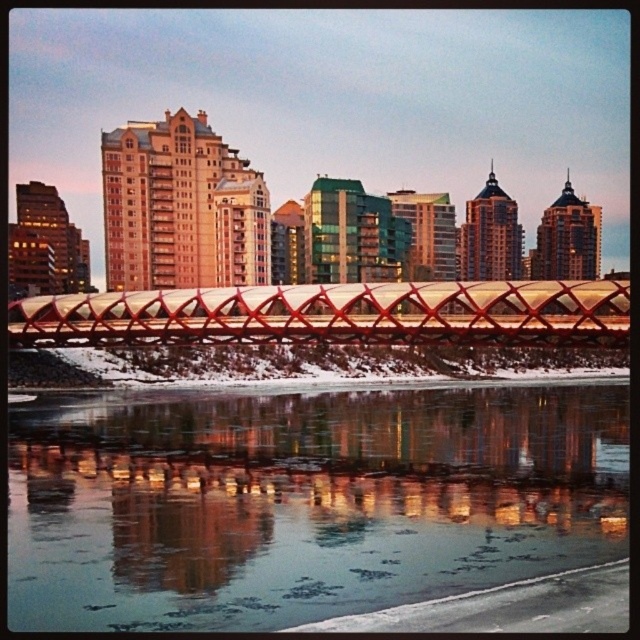
Question: Can you confirm if frozen glassy water at lower center is bigger than metallic red bridge at center?

Choices:
 (A) no
 (B) yes

Answer: (A)

Question: Is frozen glassy water at lower center wider than metallic red bridge at center?

Choices:
 (A) yes
 (B) no

Answer: (B)

Question: Which point appears farthest from the camera in this image?

Choices:
 (A) (141, 337)
 (B) (333, 579)

Answer: (A)

Question: Where is frozen glassy water at lower center located in relation to metallic red bridge at center in the image?

Choices:
 (A) below
 (B) above

Answer: (A)

Question: Which of the following is the farthest from the observer?

Choices:
 (A) metallic red bridge at center
 (B) frozen glassy water at lower center

Answer: (A)